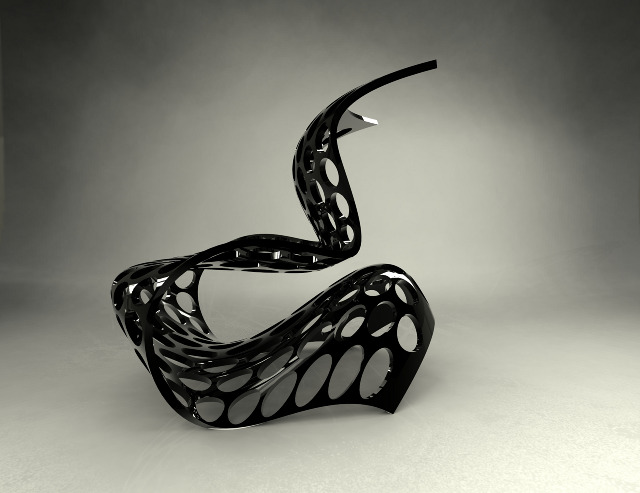
Find the location of a particular element. This screenshot has width=640, height=493. dark corners of backdrop is located at coordinates (41, 20), (588, 35).